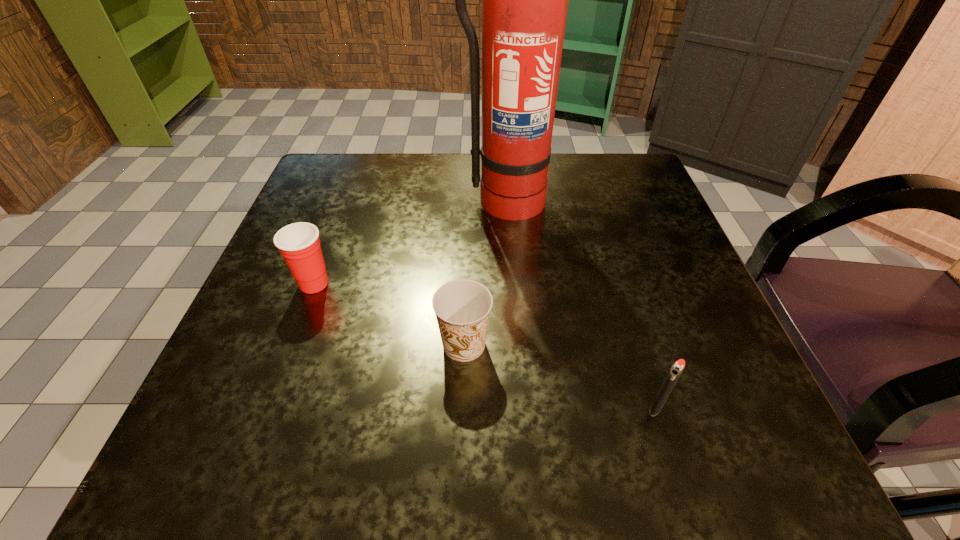
The image size is (960, 540). In order to click on vacant region at the right edge of the desktop in this screenshot , I will do `click(640, 387)`.

In the image, there is a desktop. Where is `free region at the far left corner`? free region at the far left corner is located at coordinates (355, 207).

In order to click on blank space at the far right corner in this screenshot , I will do `click(643, 168)`.

The height and width of the screenshot is (540, 960). I want to click on vacant area between the second nearest object and the farther Dixie cup, so click(389, 314).

Where is `vacant area that lies between the third farthest object and the left Dixie cup`? The image size is (960, 540). vacant area that lies between the third farthest object and the left Dixie cup is located at coordinates (389, 314).

Identify the location of unoccupied position between the fire extinguisher and the third farthest object. (484, 273).

Find the location of a particular element. The width and height of the screenshot is (960, 540). unoccupied position between the right Dixie cup and the fire extinguisher is located at coordinates (484, 273).

Find the location of `unoccupied area between the second farthest object and the third farthest object`. unoccupied area between the second farthest object and the third farthest object is located at coordinates (389, 314).

Where is `empty space between the fire extinguisher and the igniter`? The width and height of the screenshot is (960, 540). empty space between the fire extinguisher and the igniter is located at coordinates (580, 303).

Locate an element on the screen. This screenshot has width=960, height=540. vacant region between the left Dixie cup and the tallest object is located at coordinates (409, 242).